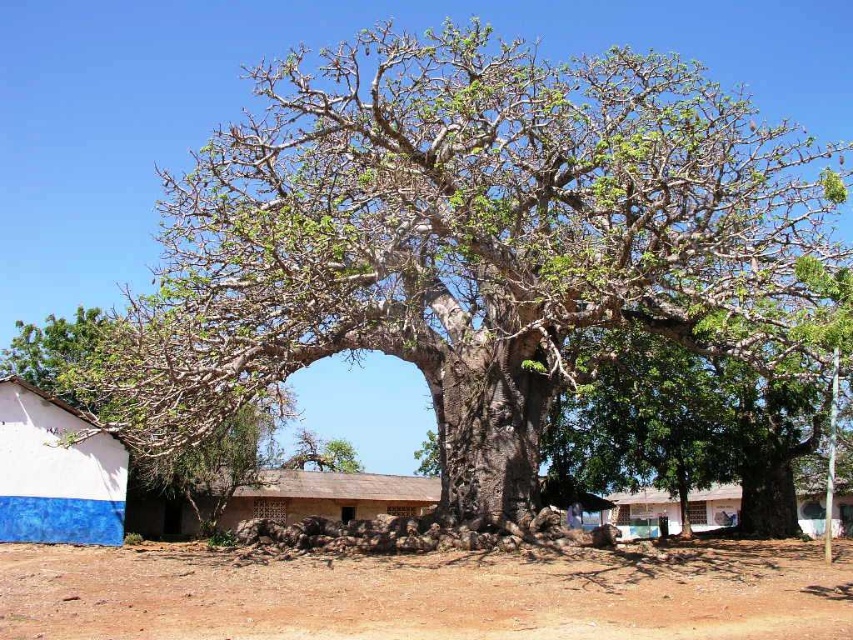
Between brown dirt field at lower center and brown clay hut at center, which one is positioned higher?

brown dirt field at lower center is higher up.

Describe the element at coordinates (427, 595) in the screenshot. I see `brown dirt field at lower center` at that location.

The height and width of the screenshot is (640, 853). What are the coordinates of `brown dirt field at lower center` in the screenshot? It's located at (427, 595).

Is brown dirt field at lower center to the left of green rough bark tree at center from the viewer's perspective?

Yes, brown dirt field at lower center is to the left of green rough bark tree at center.

Between point (810, 612) and point (426, 440), which one is positioned in front?

Positioned in front is point (810, 612).

Is point (746, 627) more distant than point (424, 467)?

No, it is in front of (424, 467).

This screenshot has width=853, height=640. In order to click on brown dirt field at lower center in this screenshot , I will do `click(427, 595)`.

Is white painted wall at lower left to the left of brown clay hut at center from the viewer's perspective?

Indeed, white painted wall at lower left is positioned on the left side of brown clay hut at center.

Identify the location of white painted wall at lower left. (56, 472).

This screenshot has height=640, width=853. Identify the location of white painted wall at lower left. (56, 472).

Where is `white painted wall at lower left`? Image resolution: width=853 pixels, height=640 pixels. white painted wall at lower left is located at coordinates (56, 472).